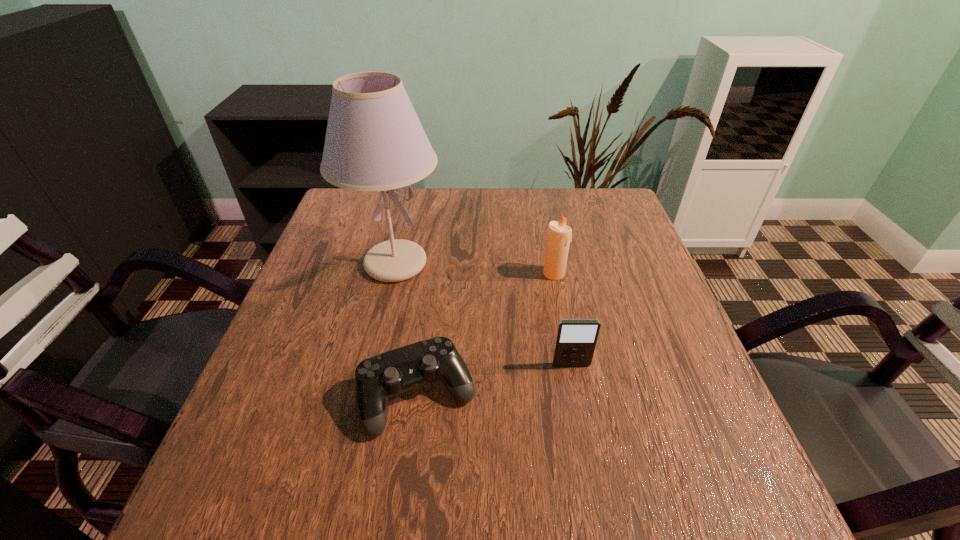
You are a GUI agent. You are given a task and a screenshot of the screen. Output one action in this format:
    pyautogui.click(x=<x>, y=<y>)
    Task: Click on the free location at the near edge of the desktop
    
    Given the screenshot: What is the action you would take?
    pyautogui.click(x=630, y=504)

You are a GUI agent. You are given a task and a screenshot of the screen. Output one action in this format:
    pyautogui.click(x=<x>, y=<y>)
    Task: Click on the vacant space at the left edge of the desktop
    The image size is (960, 540).
    Given the screenshot: What is the action you would take?
    pyautogui.click(x=365, y=285)

Where is `free space at the right edge of the desktop`? This screenshot has height=540, width=960. free space at the right edge of the desktop is located at coordinates tap(614, 301).

In order to click on vacant space at the far left corner of the desktop in this screenshot , I will do click(x=345, y=219).

The image size is (960, 540). In the image, there is a desktop. In order to click on blank space at the far right corner in this screenshot , I will do coord(620,205).

In the image, there is a desktop. Where is `vacant area at the near right corner`? The image size is (960, 540). vacant area at the near right corner is located at coordinates (727, 497).

Locate an element on the screen. The width and height of the screenshot is (960, 540). vacant space that's between the control and the candle is located at coordinates (486, 334).

Locate an element on the screen. unoccupied position between the lampshade and the shortest object is located at coordinates (407, 329).

Identify the location of free area in between the control and the iPod. (494, 380).

Locate an element on the screen. The width and height of the screenshot is (960, 540). vacant region between the tallest object and the third tallest object is located at coordinates (483, 314).